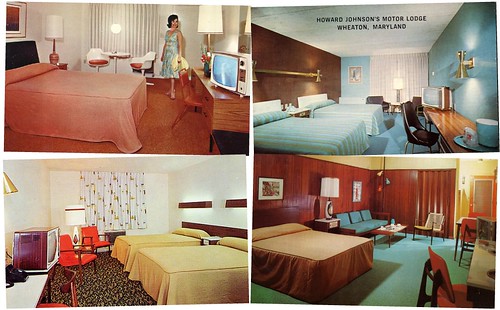
Locate an element on the screen. The width and height of the screenshot is (500, 310). nightstand is located at coordinates (59, 65), (211, 239), (296, 111), (324, 220).